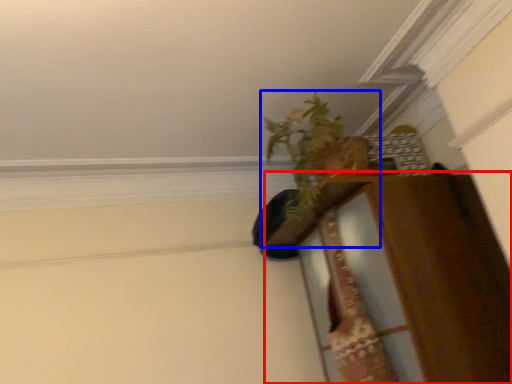
Question: Which object is further to the camera taking this photo, dresser (highlighted by a red box) or houseplant (highlighted by a blue box)?

Choices:
 (A) dresser
 (B) houseplant

Answer: (B)